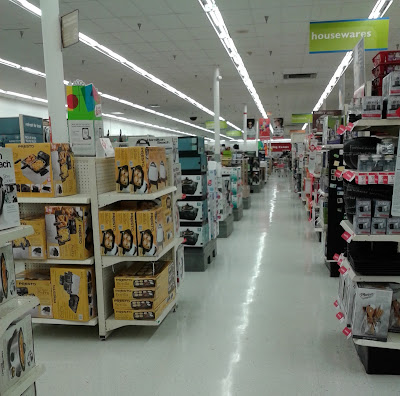
The height and width of the screenshot is (396, 400). I want to click on fire safety water nozzles in ceiling, so pos(265,18), pos(139,25), pos(273,72), pos(175,56).